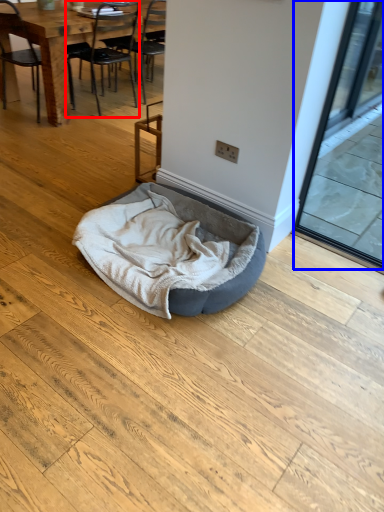
Question: Which object appears farthest to the camera in this image, chair (highlighted by a red box) or screen door (highlighted by a blue box)?

Choices:
 (A) chair
 (B) screen door

Answer: (A)